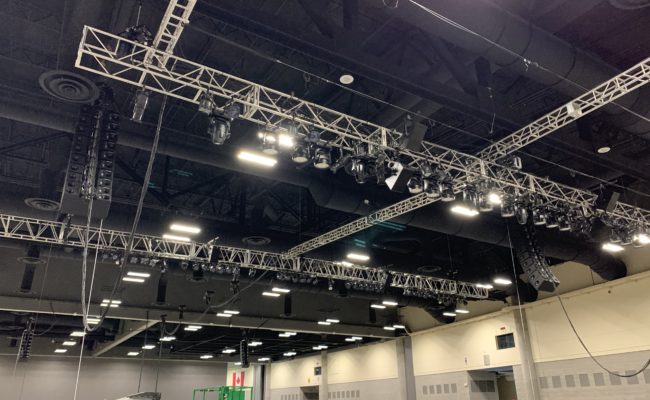
Where is `vent`? vent is located at coordinates (62, 90), (41, 199), (38, 254), (257, 243).